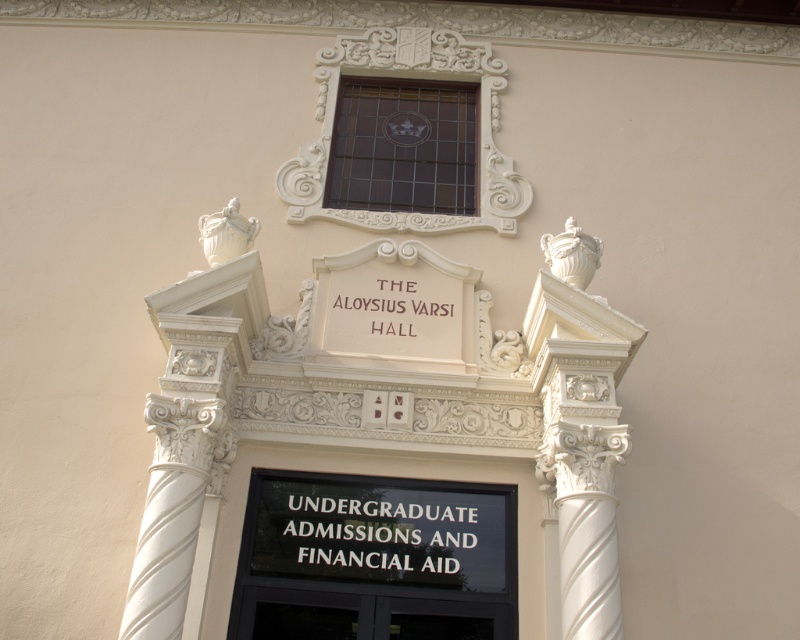
From the picture: Does black glass sign at center have a greater width compared to white marble column at right?

Indeed, black glass sign at center has a greater width compared to white marble column at right.

Who is shorter, black glass sign at center or white marble column at right?

Standing shorter between the two is black glass sign at center.

This screenshot has height=640, width=800. I want to click on black glass sign at center, so click(x=374, y=560).

Does point (594, 461) lie in front of point (336, 275)?

Yes, point (594, 461) is closer to viewer.

Can you confirm if white marble column at right is smaller than white wood sign at center?

No, white marble column at right is not smaller than white wood sign at center.

Identify the location of white marble column at right. (584, 476).

Is black glass sign at center above white wood sign at center?

Incorrect, black glass sign at center is not positioned above white wood sign at center.

Is point (329, 483) in front of point (437, 292)?

Yes, point (329, 483) is closer to viewer.

Find the location of a particular element. This screenshot has height=640, width=800. black glass sign at center is located at coordinates (374, 560).